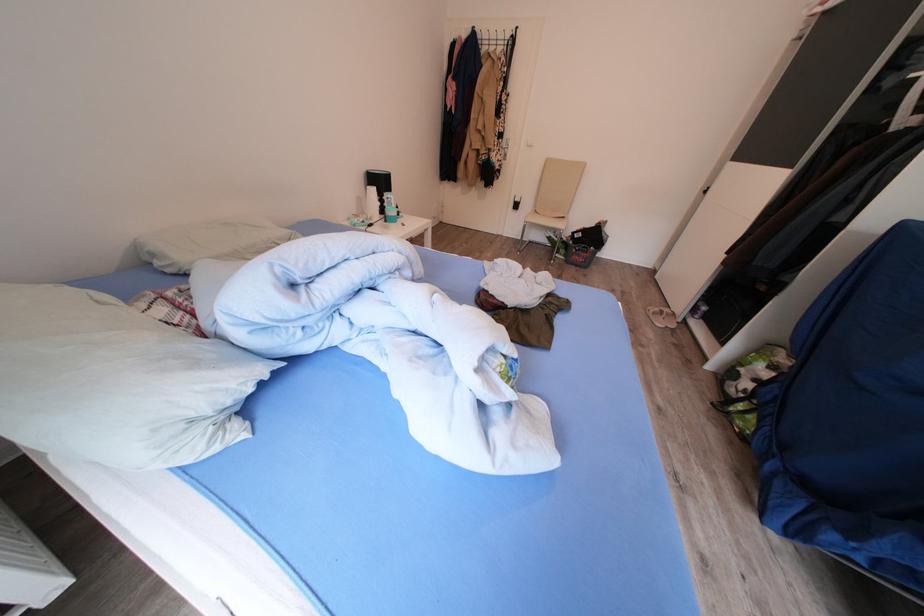
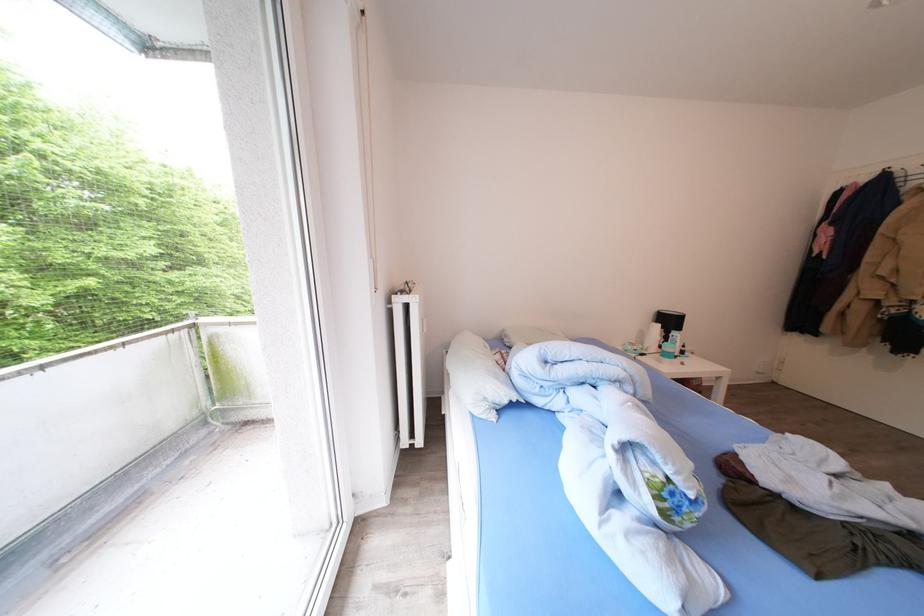
Locate, in the second image, the point that corresponds to pixel 388 188 in the first image.

(677, 326)